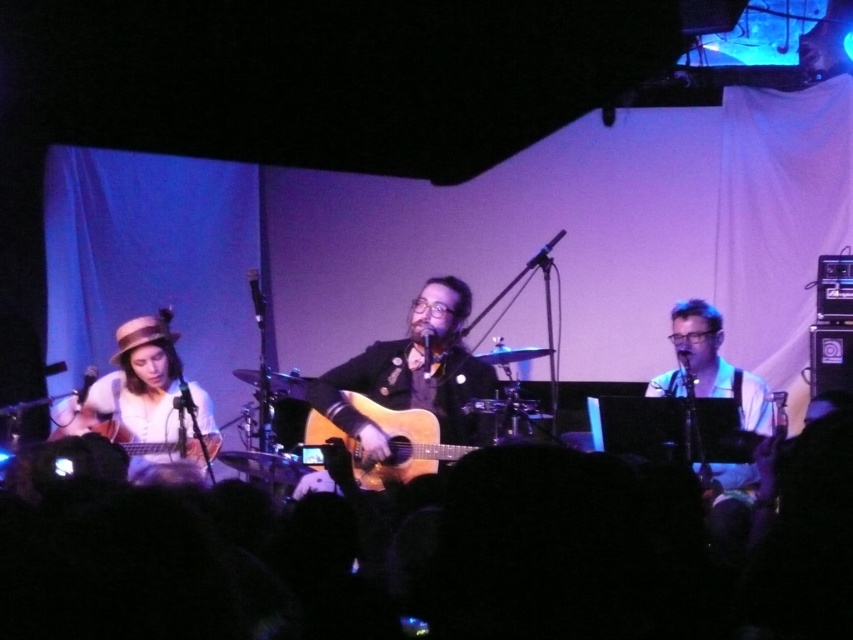
Question: Among these points, which one is farthest from the camera?

Choices:
 (A) (99, 400)
 (B) (409, 412)
 (C) (305, 486)
 (D) (714, 348)

Answer: (D)

Question: Does wooden acoustic guitar at center have a greater width compared to acoustic wood guitar at center?

Choices:
 (A) no
 (B) yes

Answer: (B)

Question: Does wooden acoustic guitar at center have a larger size compared to matte wood guitar at left?

Choices:
 (A) yes
 (B) no

Answer: (A)

Question: Which object is closer to the camera taking this photo?

Choices:
 (A) wooden acoustic guitar at center
 (B) acoustic wood guitar at center
 (C) matte wood guitar at left
 (D) matte white shirt at left

Answer: (B)

Question: Which of these objects is positioned closest to the matte wood guitar at left?

Choices:
 (A) matte white shirt at left
 (B) white fabric shirt at right
 (C) wooden acoustic guitar at center
 (D) acoustic wood guitar at center

Answer: (A)

Question: Can you confirm if wooden acoustic guitar at center is positioned to the left of white fabric shirt at right?

Choices:
 (A) no
 (B) yes

Answer: (B)